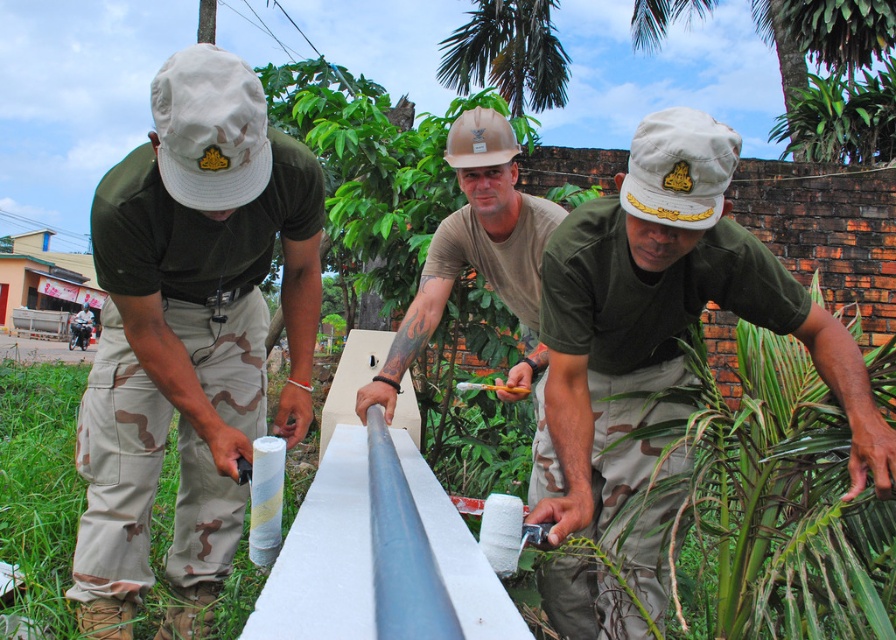
You are a photographer trying to capture a group photo of the matte khaki uniform at center and the green matte uniform at center. Since you want to ensure both uniforms are clearly visible, which uniform should you focus on first to avoid blurring due to their size difference?

The matte khaki uniform at center is larger in size compared to the green matte uniform at center, so you should focus on the matte khaki uniform at center first to ensure clarity, as larger objects may require more precise focusing to avoid blurring.

Based on the scene description, where exactly is the green matte uniform at center located in the image?

The green matte uniform at center is located at point coordinates of 0.503 in the x axis and 0.742 in the y axis.